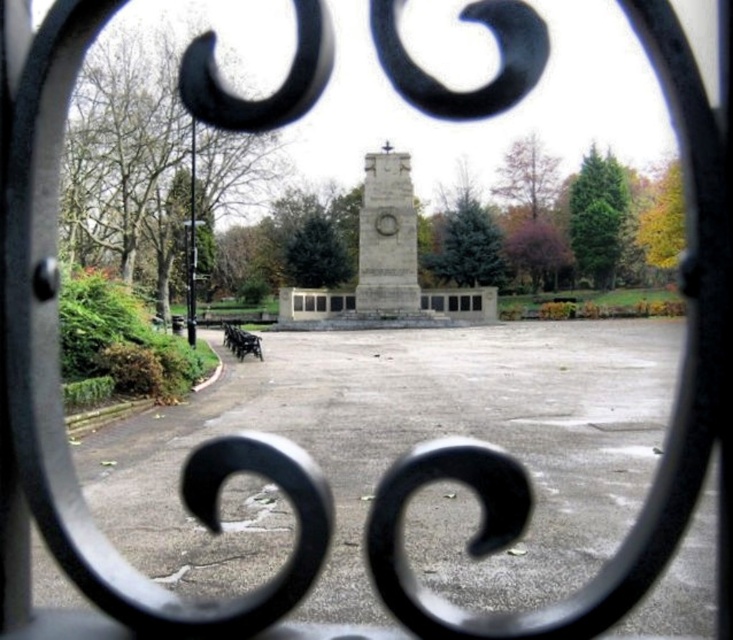
Question: Does gray concrete parking lot at center have a greater width compared to granite stone monument at center?

Choices:
 (A) yes
 (B) no

Answer: (A)

Question: Does gray concrete parking lot at center appear on the left side of granite stone monument at center?

Choices:
 (A) no
 (B) yes

Answer: (A)

Question: Which of the following is the closest to the observer?

Choices:
 (A) granite stone monument at center
 (B) gray concrete parking lot at center

Answer: (B)

Question: Is gray concrete parking lot at center to the right of granite stone monument at center from the viewer's perspective?

Choices:
 (A) yes
 (B) no

Answer: (A)